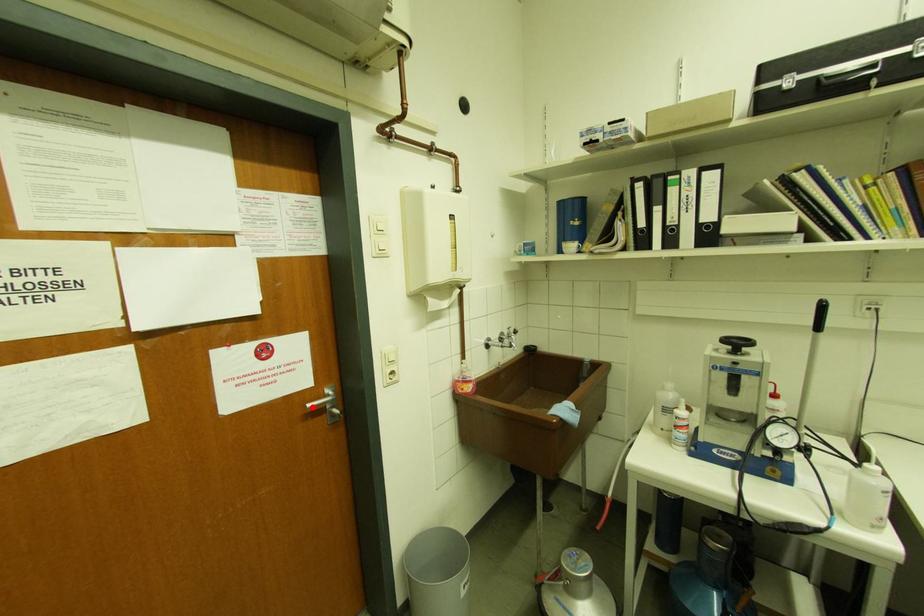
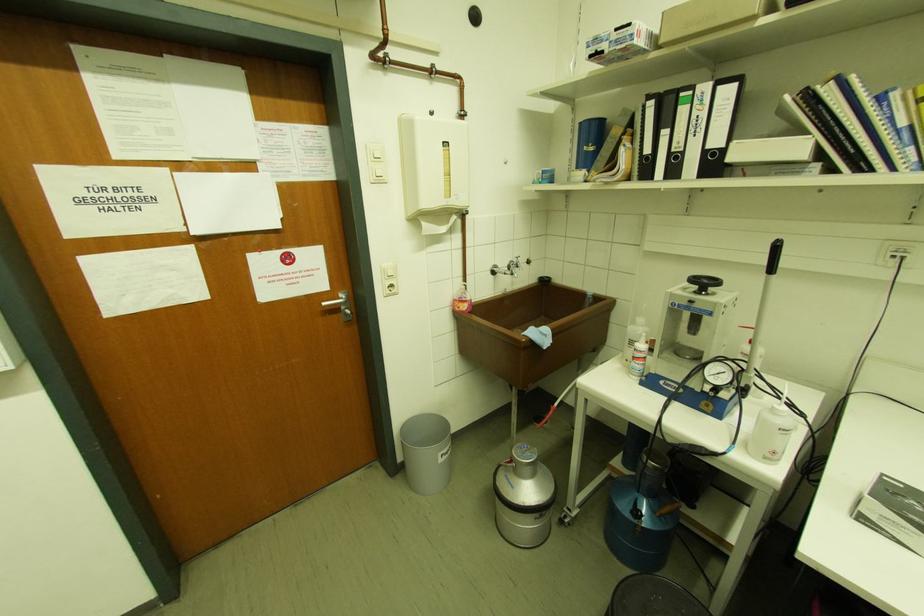
The point at the highlighted location is marked in the first image. Where is the corresponding point in the second image?

(326, 305)